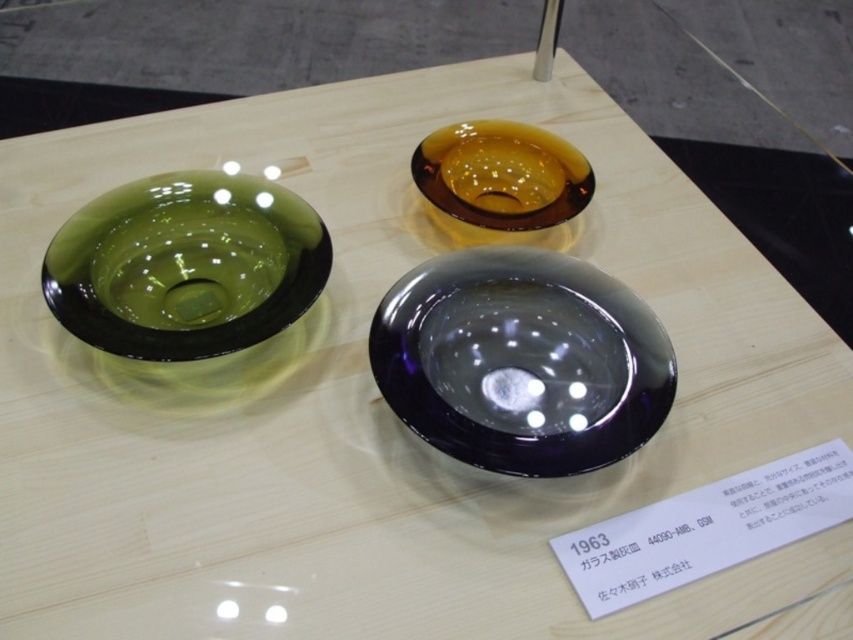
You are an interior designer arranging these bowls for a display. You want to ensure that the amber glass bowl at center and the amber glass bowl at upper center are visible to visitors standing in front of the display. Which bowl should you adjust to avoid blocking the view of the other?

The amber glass bowl at center is positioned under the amber glass bowl at upper center. To ensure both are visible, you should adjust the amber glass bowl at upper center to move it slightly to the side or raise it higher so it doesn not block the view of the amber glass bowl at center below it.